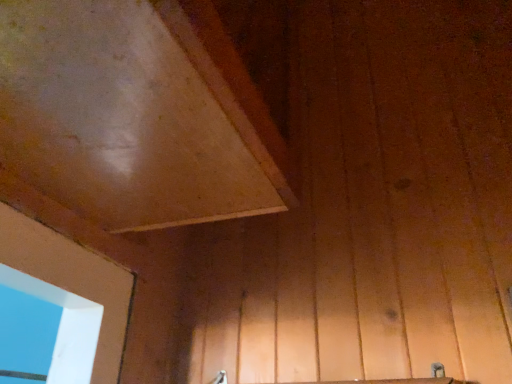
What is the approximate height of matte white exhaust hood at upper left?

The height of matte white exhaust hood at upper left is 18.52 inches.

At what (x,y) coordinates should I click in order to perform the action: click on matte white exhaust hood at upper left. Please return your answer as a coordinate pair (x, y). The image size is (512, 384). Looking at the image, I should click on (136, 113).

This screenshot has width=512, height=384. Describe the element at coordinates (136, 113) in the screenshot. I see `matte white exhaust hood at upper left` at that location.

At what (x,y) coordinates should I click in order to perform the action: click on matte white exhaust hood at upper left. Please return your answer as a coordinate pair (x, y). The height and width of the screenshot is (384, 512). Looking at the image, I should click on (136, 113).